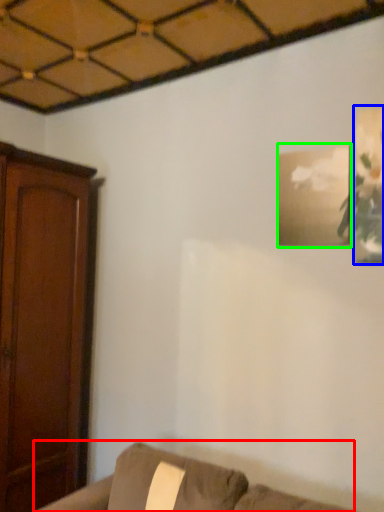
Question: Which object is the closest to the furniture (highlighted by a red box)? Choose among these: picture frame (highlighted by a blue box) or picture frame (highlighted by a green box).

Choices:
 (A) picture frame
 (B) picture frame

Answer: (B)